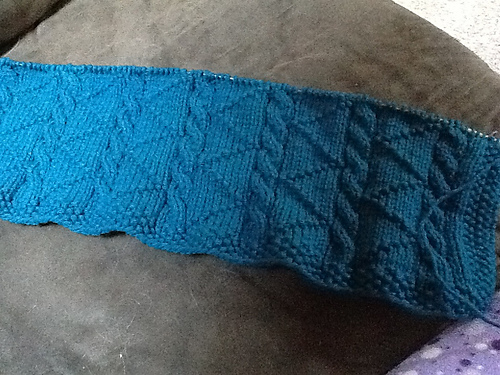
At what (x,y) coordinates should I click in order to perform the action: click on sofa. Please return your answer as a coordinate pair (x, y). This screenshot has height=375, width=500. Looking at the image, I should click on (142, 316).